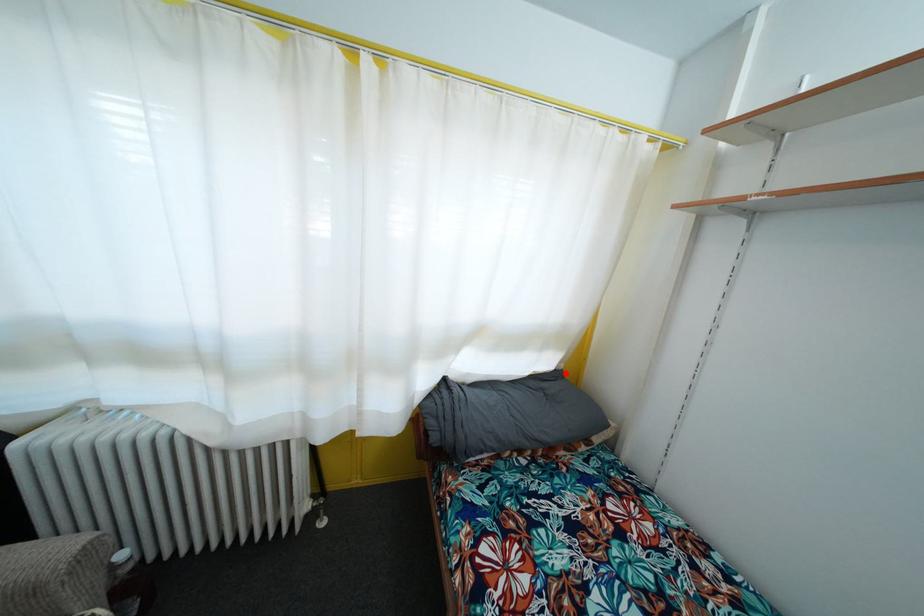
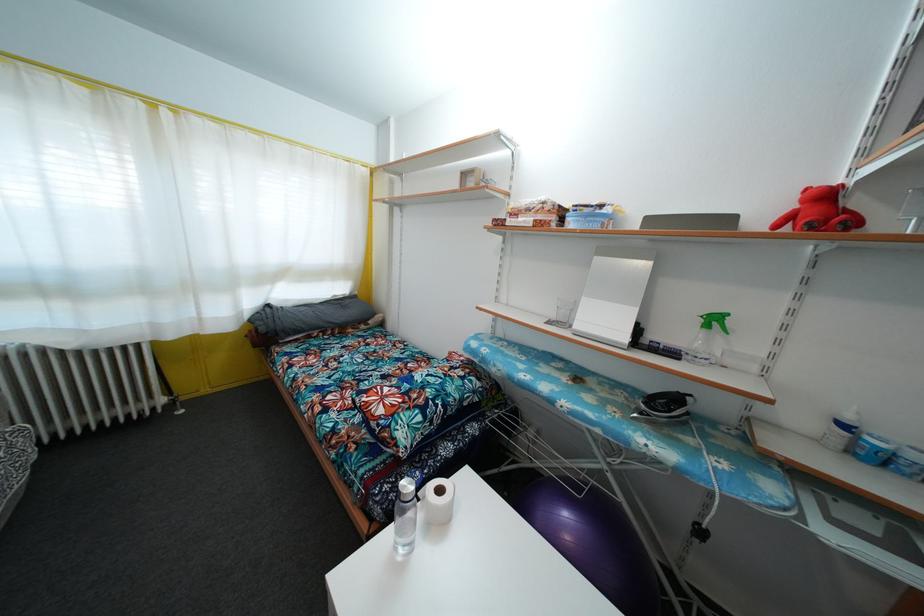
Question: A red point is marked in image1. In image2, is the corresponding 3D point closer to the camera or farther? Reply with the corresponding letter.

Choices:
 (A) The corresponding 3D point is closer.
 (B) The corresponding 3D point is farther.

Answer: (A)